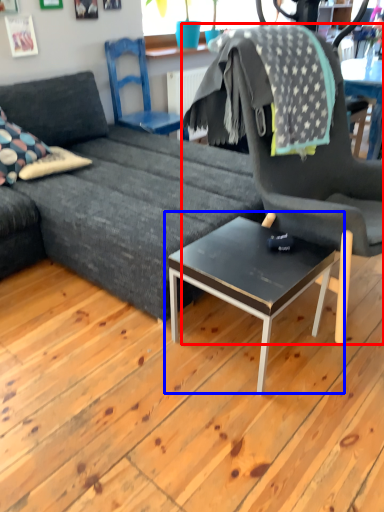
Question: Which object is closer to the camera taking this photo, chair (highlighted by a red box) or coffee table (highlighted by a blue box)?

Choices:
 (A) chair
 (B) coffee table

Answer: (A)